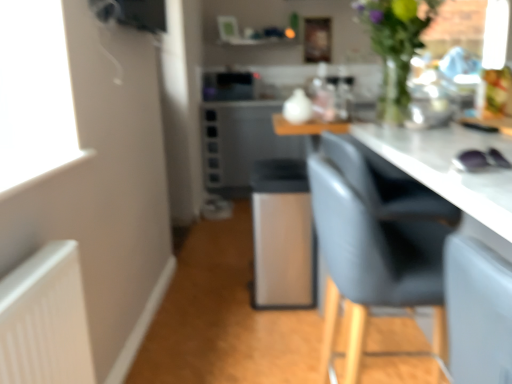
Question: Are satin silver microwave at center and satin silver bar stool at center far apart?

Choices:
 (A) yes
 (B) no

Answer: (A)

Question: Is satin silver bar stool at center completely or partially inside satin silver microwave at center?

Choices:
 (A) no
 (B) yes

Answer: (A)

Question: Considering the relative sizes of satin silver microwave at center and satin silver bar stool at center in the image provided, is satin silver microwave at center shorter than satin silver bar stool at center?

Choices:
 (A) no
 (B) yes

Answer: (B)

Question: Considering the relative positions of satin silver microwave at center and satin silver bar stool at center in the image provided, is satin silver microwave at center to the right of satin silver bar stool at center from the viewer's perspective?

Choices:
 (A) yes
 (B) no

Answer: (B)

Question: Considering the relative sizes of satin silver microwave at center and satin silver bar stool at center in the image provided, is satin silver microwave at center wider than satin silver bar stool at center?

Choices:
 (A) no
 (B) yes

Answer: (A)

Question: Is matte gray chair at right in front of or behind green glass vase at upper right in the image?

Choices:
 (A) behind
 (B) front

Answer: (B)

Question: In terms of height, does matte gray chair at right look taller or shorter compared to green glass vase at upper right?

Choices:
 (A) tall
 (B) short

Answer: (A)

Question: Based on their sizes in the image, would you say matte gray chair at right is bigger or smaller than green glass vase at upper right?

Choices:
 (A) big
 (B) small

Answer: (A)

Question: In terms of width, does matte gray chair at right look wider or thinner when compared to green glass vase at upper right?

Choices:
 (A) thin
 (B) wide

Answer: (B)

Question: In the image, is green glass vase at upper right on the left side or the right side of satin silver microwave at center?

Choices:
 (A) left
 (B) right

Answer: (B)

Question: Based on their sizes in the image, would you say green glass vase at upper right is bigger or smaller than satin silver microwave at center?

Choices:
 (A) small
 (B) big

Answer: (B)

Question: Is green glass vase at upper right inside or outside of satin silver microwave at center?

Choices:
 (A) outside
 (B) inside

Answer: (A)

Question: From the image's perspective, is green glass vase at upper right above or below satin silver microwave at center?

Choices:
 (A) below
 (B) above

Answer: (A)

Question: In terms of height, does satin silver bar stool at center look taller or shorter compared to satin silver microwave at center?

Choices:
 (A) short
 (B) tall

Answer: (B)

Question: Does point (300, 246) appear closer or farther from the camera than point (205, 96)?

Choices:
 (A) farther
 (B) closer

Answer: (B)